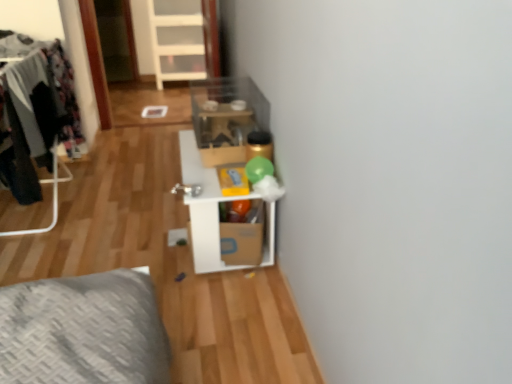
What are the coordinates of `free region under dark gray fabric clothes at left (from a real-world perspective)` in the screenshot? It's located at (74, 201).